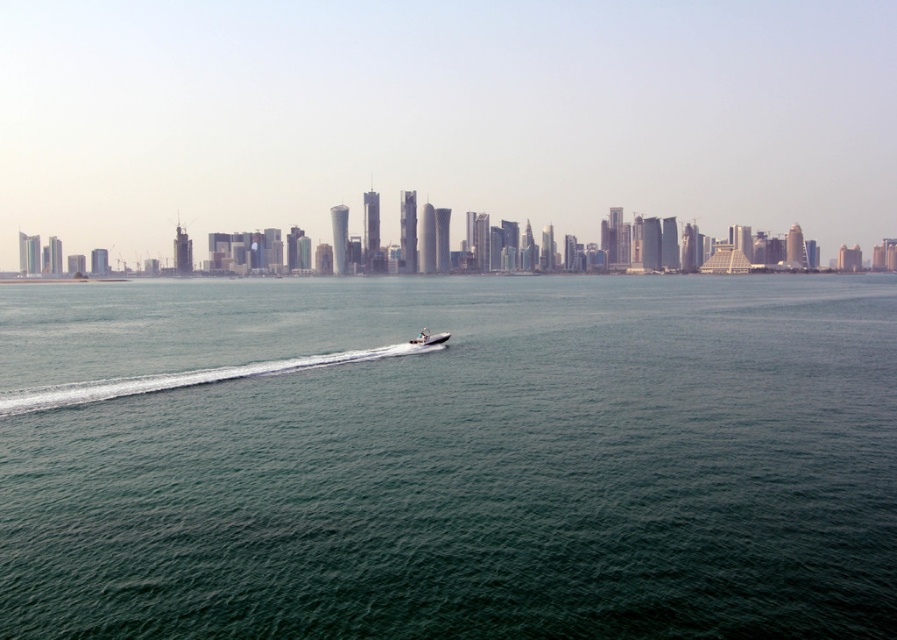
Question: Which point is closer to the camera?

Choices:
 (A) green water at center
 (B) white glossy boat at center

Answer: (A)

Question: Which point appears closest to the camera in this image?

Choices:
 (A) (364, 422)
 (B) (424, 339)

Answer: (A)

Question: In this image, where is green water at center located relative to white glossy boat at center?

Choices:
 (A) below
 (B) above

Answer: (B)

Question: Is green water at center thinner than white glossy boat at center?

Choices:
 (A) yes
 (B) no

Answer: (B)

Question: Is green water at center to the left of white glossy boat at center from the viewer's perspective?

Choices:
 (A) yes
 (B) no

Answer: (A)

Question: Among these points, which one is nearest to the camera?

Choices:
 (A) (257, 576)
 (B) (442, 342)

Answer: (A)